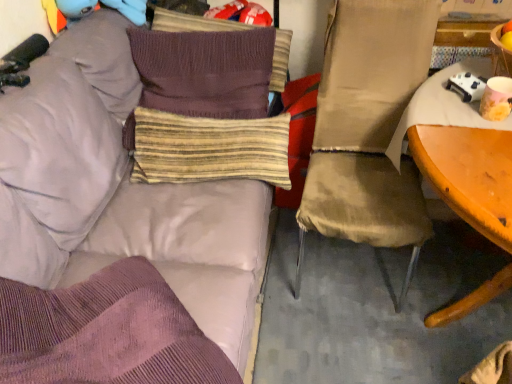
Question: Is matte beige chair at right wider than matte purple couch at upper left?

Choices:
 (A) no
 (B) yes

Answer: (A)

Question: Does matte beige chair at right have a smaller size compared to matte purple couch at upper left?

Choices:
 (A) no
 (B) yes

Answer: (B)

Question: Is matte beige chair at right positioned with its back to matte purple couch at upper left?

Choices:
 (A) no
 (B) yes

Answer: (A)

Question: Can you confirm if matte beige chair at right is positioned to the left of matte purple couch at upper left?

Choices:
 (A) no
 (B) yes

Answer: (A)

Question: From a real-world perspective, is matte beige chair at right on matte purple couch at upper left?

Choices:
 (A) yes
 (B) no

Answer: (A)

Question: Would you say matte beige chair at right is a long distance from matte purple couch at upper left?

Choices:
 (A) yes
 (B) no

Answer: (B)

Question: Is matte purple couch at upper left inside striped fabric pillow at center, the fourth pillow when ordered from top to bottom?

Choices:
 (A) yes
 (B) no

Answer: (B)

Question: Can you see striped fabric pillow at center, the fourth pillow when ordered from top to bottom, touching matte purple couch at upper left?

Choices:
 (A) yes
 (B) no

Answer: (B)

Question: Is striped fabric pillow at center, the fourth pillow when ordered from top to bottom, not within matte purple couch at upper left?

Choices:
 (A) no
 (B) yes

Answer: (A)

Question: From a real-world perspective, is striped fabric pillow at center, the fourth pillow when ordered from top to bottom, below matte purple couch at upper left?

Choices:
 (A) yes
 (B) no

Answer: (B)

Question: Considering the relative sizes of striped fabric pillow at center, the first pillow when ordered from bottom to top, and matte purple couch at upper left in the image provided, is striped fabric pillow at center, the first pillow when ordered from bottom to top, wider than matte purple couch at upper left?

Choices:
 (A) no
 (B) yes

Answer: (A)

Question: From a real-world perspective, is striped fabric pillow at center, the first pillow when ordered from bottom to top, physically above matte purple couch at upper left?

Choices:
 (A) yes
 (B) no

Answer: (A)

Question: Considering the relative sizes of knitted brown pillow at upper center, the 1th pillow when ordered from top to bottom, and knitted brown pillow at center, the 2th pillow from the top, in the image provided, is knitted brown pillow at upper center, the 1th pillow when ordered from top to bottom, smaller than knitted brown pillow at center, the 2th pillow from the top,?

Choices:
 (A) yes
 (B) no

Answer: (A)